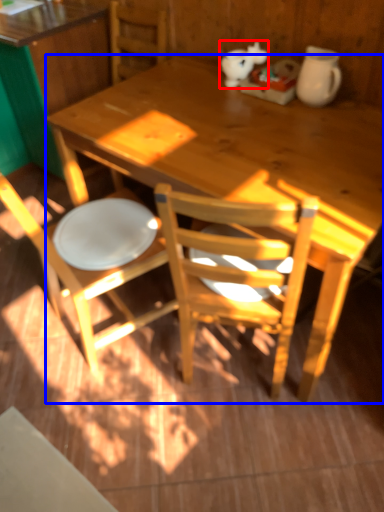
Question: Among these objects, which one is farthest to the camera, animal (highlighted by a red box) or desk (highlighted by a blue box)?

Choices:
 (A) animal
 (B) desk

Answer: (A)